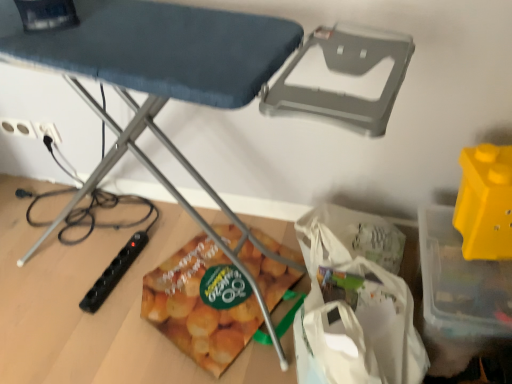
Question: From a real-world perspective, is white fabric grocery bag at lower center physically below matte plastic snack bag at lower center?

Choices:
 (A) no
 (B) yes

Answer: (A)

Question: Is white fabric grocery bag at lower center taller than matte plastic snack bag at lower center?

Choices:
 (A) no
 (B) yes

Answer: (B)

Question: Would you say white fabric grocery bag at lower center contains matte plastic snack bag at lower center?

Choices:
 (A) no
 (B) yes

Answer: (A)

Question: Considering the relative sizes of white fabric grocery bag at lower center and matte plastic snack bag at lower center in the image provided, is white fabric grocery bag at lower center thinner than matte plastic snack bag at lower center?

Choices:
 (A) no
 (B) yes

Answer: (B)

Question: Does white fabric grocery bag at lower center have a larger size compared to matte plastic snack bag at lower center?

Choices:
 (A) no
 (B) yes

Answer: (B)

Question: Looking at the image, does white plastic electric outlet at lower left, acting as the 2th electric outlet starting from the left, seem bigger or smaller compared to matte plastic snack bag at lower center?

Choices:
 (A) big
 (B) small

Answer: (B)

Question: In terms of width, does white plastic electric outlet at lower left, acting as the 2th electric outlet starting from the left, look wider or thinner when compared to matte plastic snack bag at lower center?

Choices:
 (A) wide
 (B) thin

Answer: (B)

Question: In the image, is white plastic electric outlet at lower left, acting as the 2th electric outlet starting from the left, positioned in front of or behind matte plastic snack bag at lower center?

Choices:
 (A) front
 (B) behind

Answer: (B)

Question: Is point (48, 129) closer or farther from the camera than point (250, 266)?

Choices:
 (A) farther
 (B) closer

Answer: (A)

Question: Based on their sizes in the image, would you say white plastic electric outlet at upper left, which is counted as the 1th electric outlet, starting from the left, is bigger or smaller than metallic ironing board at center?

Choices:
 (A) small
 (B) big

Answer: (A)

Question: Is white plastic electric outlet at upper left, positioned as the 2th electric outlet in right-to-left order, situated inside metallic ironing board at center or outside?

Choices:
 (A) outside
 (B) inside

Answer: (A)

Question: Does point (20, 120) appear closer or farther from the camera than point (258, 296)?

Choices:
 (A) closer
 (B) farther

Answer: (B)

Question: From a real-world perspective, is white plastic electric outlet at upper left, positioned as the 2th electric outlet in right-to-left order, above or below metallic ironing board at center?

Choices:
 (A) above
 (B) below

Answer: (B)

Question: From the image's perspective, relative to white plastic electric outlet at lower left, acting as the 2th electric outlet starting from the left, is matte plastic snack bag at lower center above or below?

Choices:
 (A) below
 (B) above

Answer: (A)

Question: Considering the positions of matte plastic snack bag at lower center and white plastic electric outlet at lower left, which appears as the first electric outlet when viewed from the right, in the image, is matte plastic snack bag at lower center wider or thinner than white plastic electric outlet at lower left, which appears as the first electric outlet when viewed from the right,?

Choices:
 (A) wide
 (B) thin

Answer: (A)